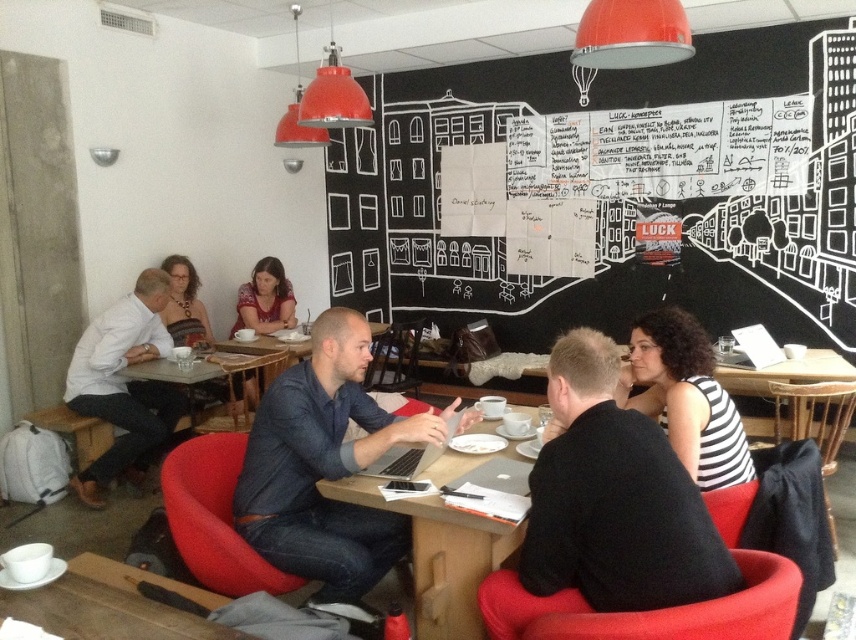
Question: Is matte red chair at lower center wider than matte black dress at upper left?

Choices:
 (A) yes
 (B) no

Answer: (A)

Question: Which of these objects is positioned closest to the denim shirt at center?

Choices:
 (A) matte black shirt at center
 (B) matte red chair at lower center
 (C) matte black chair at center

Answer: (B)

Question: Based on their relative distances, which object is farther from the black matte shirt at center?

Choices:
 (A) striped fabric shirt at center
 (B) wooden chair at center
 (C) blackboard at upper right

Answer: (C)

Question: Is black matte shirt at center to the right of denim shirt at center from the viewer's perspective?

Choices:
 (A) no
 (B) yes

Answer: (B)

Question: Which of the following is the farthest from the observer?

Choices:
 (A) matte black shirt at center
 (B) wooden table at center
 (C) wooden chair at center

Answer: (A)

Question: Can you confirm if blackboard at upper right is bigger than dark blue fabric chair at lower right?

Choices:
 (A) no
 (B) yes

Answer: (B)